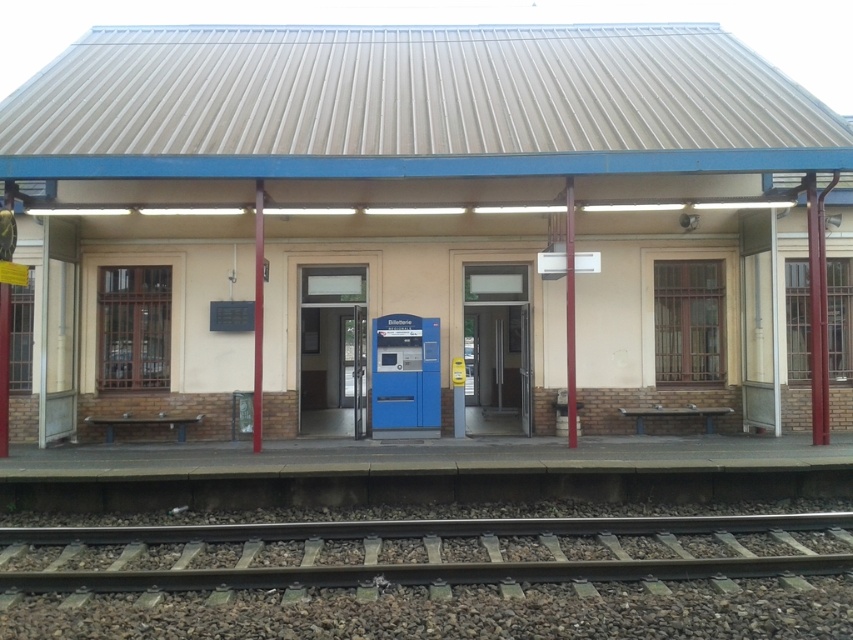
Based on the photo, you are standing at the entrance of the train station and want to reach the ticket machine inside. There are two points marked as point 1 at coordinates point (337, 288) and point 2 at coordinates point (235, 557). Which point should you move towards to reach the ticket machine first?

Point 1 at coordinates point (337, 288) is behind point 2 at coordinates point (235, 557), so you should move towards point 2 first to reach the ticket machine.